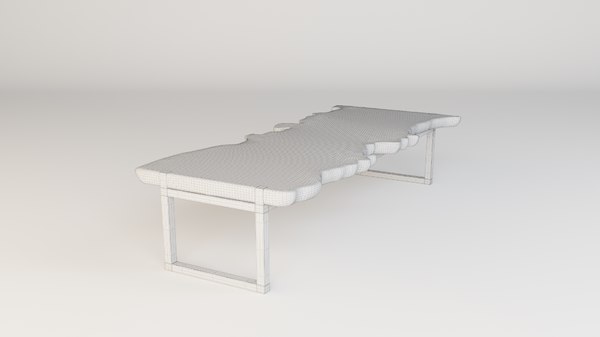
You are a GUI agent. You are given a task and a screenshot of the screen. Output one action in this format:
    pyautogui.click(x=<x>, y=<y>)
    Task: Click on the bottom leg brace
    This screenshot has height=337, width=600.
    Given the screenshot: What is the action you would take?
    pyautogui.click(x=212, y=274), pyautogui.click(x=397, y=176)